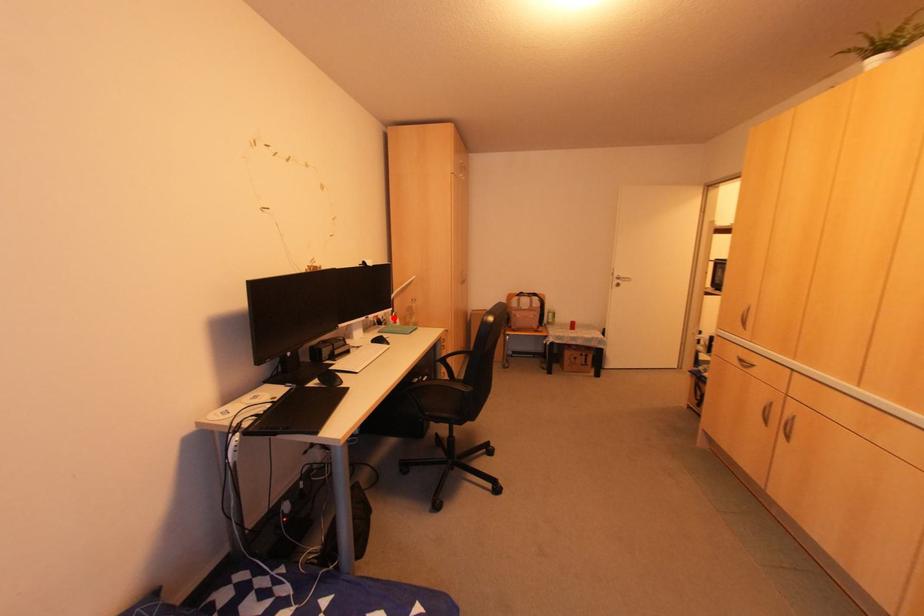
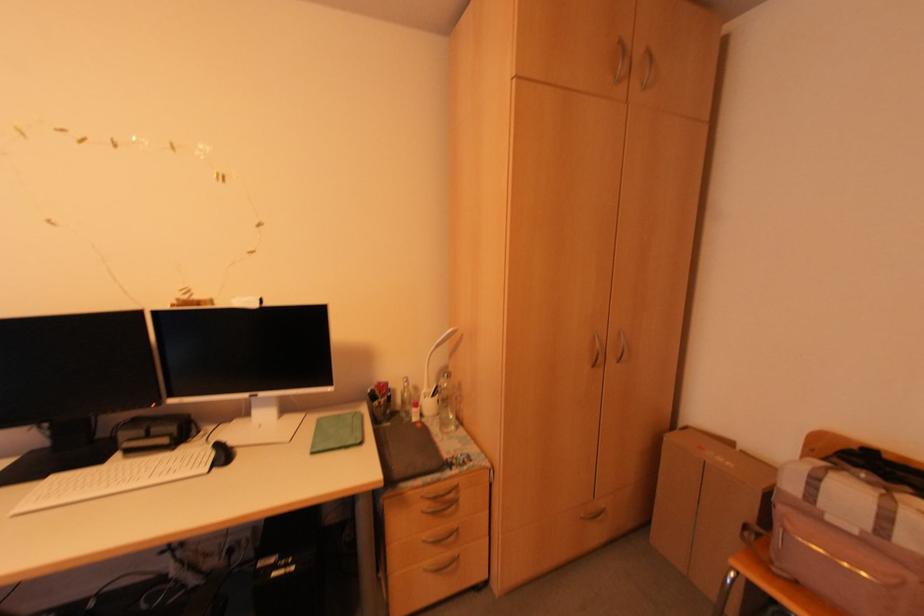
Question: I am providing you with two images of the same scene from different viewpoints. Given a red point in image1, look at the same physical point in image2. Is it:

Choices:
 (A) Closer to the viewpoint
 (B) Farther from the viewpoint

Answer: (B)